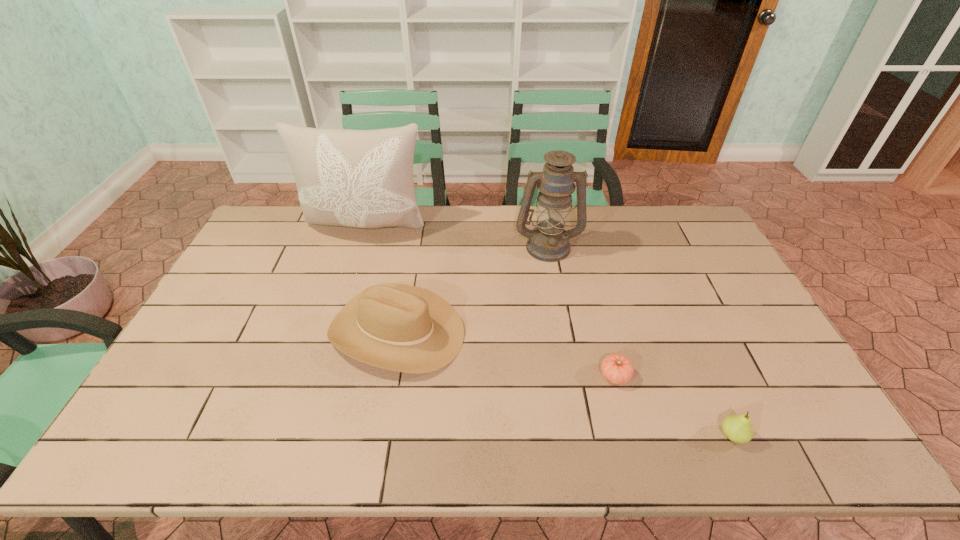
The width and height of the screenshot is (960, 540). I want to click on cushion, so click(x=357, y=178).

Where is `oil lamp`? The width and height of the screenshot is (960, 540). oil lamp is located at coordinates (549, 242).

Locate an element on the screen. cowboy hat is located at coordinates (399, 327).

Identify the location of the nearest object. The width and height of the screenshot is (960, 540). (738, 428).

At what (x,y) coordinates should I click in order to perform the action: click on the second shortest object. Please return your answer as a coordinate pair (x, y). Image resolution: width=960 pixels, height=540 pixels. Looking at the image, I should click on (738, 428).

Where is `the shortest object`? This screenshot has height=540, width=960. the shortest object is located at coordinates point(616,368).

Find the location of a particular element. vacant space positioned on the front side of the cushion is located at coordinates (338, 317).

You are a GUI agent. You are given a task and a screenshot of the screen. Output one action in this format:
    pyautogui.click(x=<x>, y=<y>)
    Task: Click on the vacant area located 0.340m on the left of the oil lamp
    The height and width of the screenshot is (540, 960).
    Given the screenshot: What is the action you would take?
    pyautogui.click(x=417, y=246)

Where is `free region located on the right of the cowboy hat`? free region located on the right of the cowboy hat is located at coordinates (510, 332).

You are a GUI agent. You are given a task and a screenshot of the screen. Output one action in this format:
    pyautogui.click(x=<x>, y=<y>)
    Task: Click on the free space located on the left of the rightmost object
    
    Given the screenshot: What is the action you would take?
    pyautogui.click(x=564, y=435)